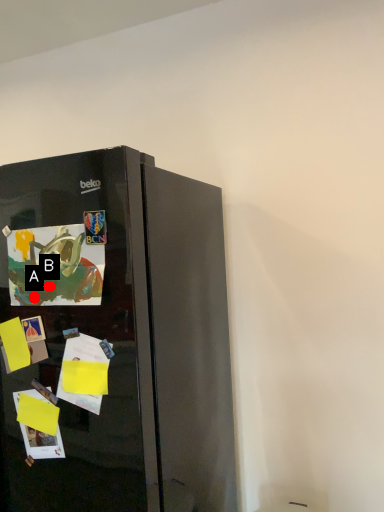
Question: Two points are circled on the image, labeled by A and B beside each circle. Which point is farther from the camera taking this photo?

Choices:
 (A) A is further
 (B) B is further

Answer: (A)